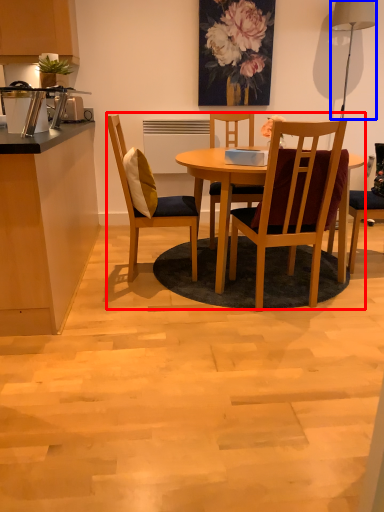
Question: Which object is closer to the camera taking this photo, kitchen & dining room table (highlighted by a red box) or lamp (highlighted by a blue box)?

Choices:
 (A) kitchen & dining room table
 (B) lamp

Answer: (A)